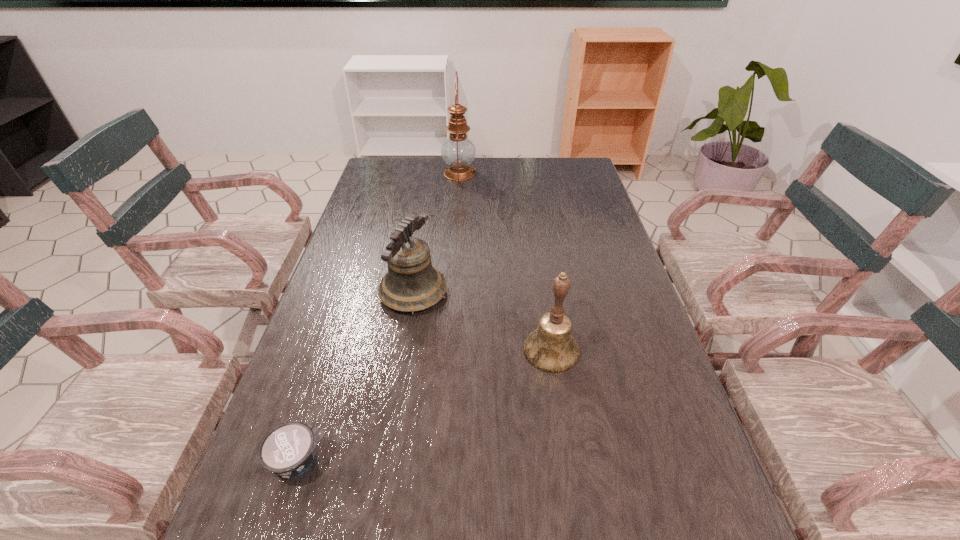
Find the location of a particular element. This screenshot has height=540, width=960. object that can be found as the second closest to the nearer bell is located at coordinates (288, 450).

The image size is (960, 540). What are the coordinates of `free point that satisfies the following two spatial constraints: 1. on the front side of the second farthest object; 2. on the right side of the second nearest object` in the screenshot? It's located at (404, 350).

You are a GUI agent. You are given a task and a screenshot of the screen. Output one action in this format:
    pyautogui.click(x=<x>, y=<y>)
    Task: Click on the free region that satisfies the following two spatial constraints: 1. on the back side of the left bell; 2. on the left side of the tallest object
    
    Given the screenshot: What is the action you would take?
    pyautogui.click(x=433, y=173)

Identify the location of vacant space that satisfies the following two spatial constraints: 1. on the back side of the leftmost object; 2. on the left side of the left bell. The image size is (960, 540). (352, 293).

Image resolution: width=960 pixels, height=540 pixels. Identify the location of vacant area in the image that satisfies the following two spatial constraints: 1. on the front side of the oil lamp; 2. on the left side of the right bell. (446, 350).